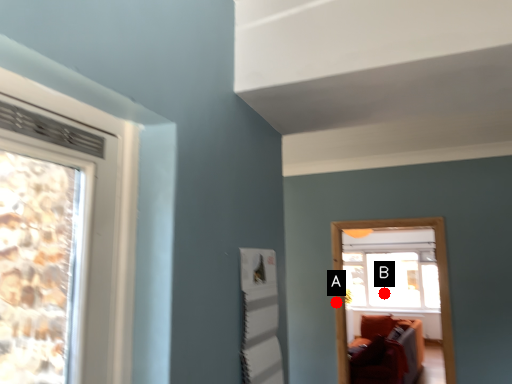
Question: Two points are circled on the image, labeled by A and B beside each circle. Which of the following is the farthest from the observer?

Choices:
 (A) A is further
 (B) B is further

Answer: (B)